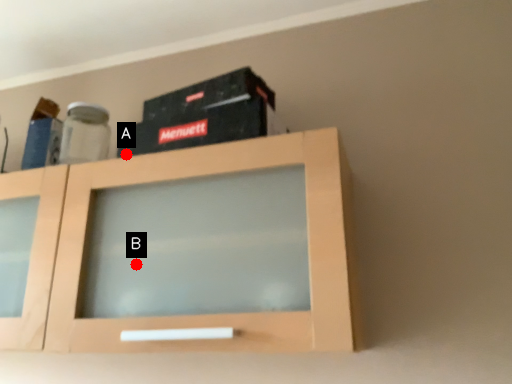
Question: Two points are circled on the image, labeled by A and B beside each circle. Which point is closer to the camera taking this photo?

Choices:
 (A) A is closer
 (B) B is closer

Answer: (B)